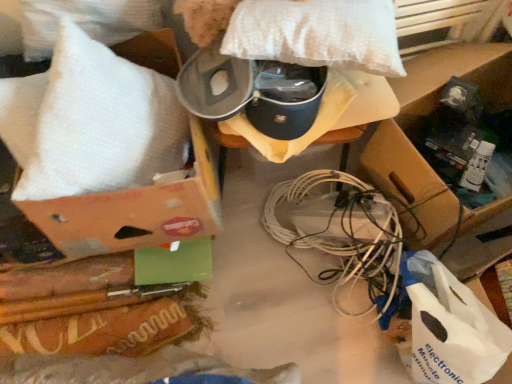
Describe the element at coordinates (90, 122) in the screenshot. I see `white bubble wrap at upper left, the 2th pillow when ordered from right to left` at that location.

At what (x,y) coordinates should I click in order to perform the action: click on white dotted pillow at upper center, which is the 2th pillow in left-to-right order. Please return your answer as a coordinate pair (x, y). This screenshot has height=384, width=512. Looking at the image, I should click on (317, 34).

What do you see at coordinates (450, 326) in the screenshot? I see `white plastic bag at lower right` at bounding box center [450, 326].

At what (x,y) coordinates should I click in order to perform the action: click on white plastic bag at lower right. Please return your answer as a coordinate pair (x, y). Image resolution: width=512 pixels, height=384 pixels. Looking at the image, I should click on (450, 326).

The height and width of the screenshot is (384, 512). Describe the element at coordinates (345, 234) in the screenshot. I see `white plastic wire at center` at that location.

Identify the location of brown cardboard box at lower right. (430, 165).

I want to click on white bubble wrap at upper left, marked as the first pillow in a left-to-right arrangement, so click(90, 122).

Which object is thinner, brown cardboard box at lower right or white dotted pillow at upper center, the first pillow in the right-to-left sequence?

With smaller width is white dotted pillow at upper center, the first pillow in the right-to-left sequence.

Is brown cardboard box at lower right bigger than white dotted pillow at upper center, which is the 2th pillow in left-to-right order?

Indeed, brown cardboard box at lower right has a larger size compared to white dotted pillow at upper center, which is the 2th pillow in left-to-right order.

How far apart are white plastic bag at lower right and brown cardboard box at lower right?

They are 11.87 inches apart.

You are a GUI agent. You are given a task and a screenshot of the screen. Output one action in this format:
    pyautogui.click(x=<x>, y=<y>)
    Task: Click on the cardboard box that is behind the white plastic bag at lower right
    This screenshot has width=512, height=384.
    Given the screenshot: What is the action you would take?
    pyautogui.click(x=430, y=165)

From the image's perspective, is white plastic bag at lower right positioned above or below brown cardboard box at lower right?

Based on their image positions, white plastic bag at lower right is located beneath brown cardboard box at lower right.

From a real-world perspective, who is located lower, white plastic bag at lower right or brown cardboard box at lower right?

white plastic bag at lower right, from a real-world perspective.

From a real-world perspective, is white bubble wrap at upper left, the 2th pillow when ordered from right to left, below white plastic bag at lower right?

No, from a real-world perspective, white bubble wrap at upper left, the 2th pillow when ordered from right to left, is not under white plastic bag at lower right.

Does point (53, 139) lie in front of point (461, 371)?

That is True.

The height and width of the screenshot is (384, 512). I want to click on pillow that is the 2nd object to the left of the white plastic bag at lower right, starting at the anchor, so click(x=90, y=122).

Is point (281, 200) behind point (332, 33)?

Yes.

Who is smaller, white plastic wire at center or white dotted pillow at upper center, which is the 2th pillow in left-to-right order?

white dotted pillow at upper center, which is the 2th pillow in left-to-right order.

Is white plastic wire at center completely or partially outside of white dotted pillow at upper center, the first pillow in the right-to-left sequence?

white plastic wire at center is positioned outside white dotted pillow at upper center, the first pillow in the right-to-left sequence.

Can you confirm if white plastic wire at center is positioned to the right of white dotted pillow at upper center, which is the 2th pillow in left-to-right order?

Yes, white plastic wire at center is to the right of white dotted pillow at upper center, which is the 2th pillow in left-to-right order.

Does white bubble wrap at upper left, marked as the first pillow in a left-to-right arrangement, have a greater height compared to brown cardboard box at lower right?

In fact, white bubble wrap at upper left, marked as the first pillow in a left-to-right arrangement, may be shorter than brown cardboard box at lower right.

Considering the sizes of white bubble wrap at upper left, marked as the first pillow in a left-to-right arrangement, and brown cardboard box at lower right in the image, is white bubble wrap at upper left, marked as the first pillow in a left-to-right arrangement, bigger or smaller than brown cardboard box at lower right?

Clearly, white bubble wrap at upper left, marked as the first pillow in a left-to-right arrangement, is smaller in size than brown cardboard box at lower right.

Between white bubble wrap at upper left, the 2th pillow when ordered from right to left, and brown cardboard box at lower right, which one appears on the left side from the viewer's perspective?

white bubble wrap at upper left, the 2th pillow when ordered from right to left, is more to the left.

Who is more distant, white bubble wrap at upper left, marked as the first pillow in a left-to-right arrangement, or brown cardboard box at lower right?

brown cardboard box at lower right.

Considering the sizes of objects white dotted pillow at upper center, which is the 2th pillow in left-to-right order, and white plastic bag at lower right in the image provided, who is wider, white dotted pillow at upper center, which is the 2th pillow in left-to-right order, or white plastic bag at lower right?

white dotted pillow at upper center, which is the 2th pillow in left-to-right order, is wider.

Considering the positions of objects white dotted pillow at upper center, which is the 2th pillow in left-to-right order, and white plastic bag at lower right in the image provided, who is behind, white dotted pillow at upper center, which is the 2th pillow in left-to-right order, or white plastic bag at lower right?

white plastic bag at lower right is more distant.

How distant is white dotted pillow at upper center, the first pillow in the right-to-left sequence, from white plastic bag at lower right?

23.51 inches.

Between white dotted pillow at upper center, which is the 2th pillow in left-to-right order, and white plastic bag at lower right, which one has less height?

With less height is white dotted pillow at upper center, which is the 2th pillow in left-to-right order.

Which object is closer to the camera, white plastic wire at center or brown cardboard box at lower right?

brown cardboard box at lower right is more forward.

Does white plastic wire at center have a smaller size compared to brown cardboard box at lower right?

Yes.

Which is farther, (376, 219) or (457, 269)?

The point (457, 269) is farther from the camera.

From a real-world perspective, is white plastic wire at center over brown cardboard box at lower right?

No, from a real-world perspective, white plastic wire at center is not on top of brown cardboard box at lower right.

Locate an element on the screen. Image resolution: width=512 pixels, height=384 pixels. cardboard box to the right of white dotted pillow at upper center, which is the 2th pillow in left-to-right order is located at coordinates [x=430, y=165].

At what (x,y) coordinates should I click in order to perform the action: click on cardboard box behind the white plastic bag at lower right. Please return your answer as a coordinate pair (x, y). Image resolution: width=512 pixels, height=384 pixels. Looking at the image, I should click on (430, 165).

Considering their positions, is white plastic wire at center positioned further to brown cardboard box at lower right than white dotted pillow at upper center, the first pillow in the right-to-left sequence?

Among the two, white dotted pillow at upper center, the first pillow in the right-to-left sequence, is located further to brown cardboard box at lower right.

When comparing their distances from white bubble wrap at upper left, marked as the first pillow in a left-to-right arrangement, does white plastic wire at center or white dotted pillow at upper center, which is the 2th pillow in left-to-right order, seem further?

white plastic wire at center is positioned further to the anchor white bubble wrap at upper left, marked as the first pillow in a left-to-right arrangement.

Which object lies nearer to the anchor point white dotted pillow at upper center, the first pillow in the right-to-left sequence, brown cardboard box at lower right or white plastic bag at lower right?

The object closer to white dotted pillow at upper center, the first pillow in the right-to-left sequence, is brown cardboard box at lower right.

Based on the photo, considering their positions, is white dotted pillow at upper center, which is the 2th pillow in left-to-right order, positioned closer to white plastic wire at center than white bubble wrap at upper left, marked as the first pillow in a left-to-right arrangement?

white dotted pillow at upper center, which is the 2th pillow in left-to-right order, is closer to white plastic wire at center.

From the image, which object appears to be farther from white plastic wire at center, white plastic bag at lower right or brown cardboard box at lower right?

brown cardboard box at lower right.

Considering their positions, is white plastic wire at center positioned further to white dotted pillow at upper center, which is the 2th pillow in left-to-right order, than white plastic bag at lower right?

white plastic bag at lower right is positioned further to the anchor white dotted pillow at upper center, which is the 2th pillow in left-to-right order.

When comparing their distances from white plastic wire at center, does white plastic bag at lower right or white dotted pillow at upper center, the first pillow in the right-to-left sequence, seem further?

white dotted pillow at upper center, the first pillow in the right-to-left sequence.

Based on their spatial positions, is white plastic wire at center or white dotted pillow at upper center, which is the 2th pillow in left-to-right order, further from white plastic bag at lower right?

Among the two, white dotted pillow at upper center, which is the 2th pillow in left-to-right order, is located further to white plastic bag at lower right.

Find the location of a particular element. This screenshot has height=384, width=512. pillow located between white bubble wrap at upper left, the 2th pillow when ordered from right to left, and white plastic bag at lower right in the left-right direction is located at coordinates (317, 34).

The width and height of the screenshot is (512, 384). I want to click on wire between white bubble wrap at upper left, marked as the first pillow in a left-to-right arrangement, and white plastic bag at lower right, in the horizontal direction, so click(x=345, y=234).

Where is `wire between brown cardboard box at lower right and white plastic bag at lower right vertically`? This screenshot has width=512, height=384. wire between brown cardboard box at lower right and white plastic bag at lower right vertically is located at coordinates (345, 234).

You are a GUI agent. You are given a task and a screenshot of the screen. Output one action in this format:
    pyautogui.click(x=<x>, y=<y>)
    Task: Click on the wire located between white bubble wrap at upper left, marked as the first pillow in a left-to-right arrangement, and brown cardboard box at lower right in the left-right direction
    The width and height of the screenshot is (512, 384).
    Given the screenshot: What is the action you would take?
    pyautogui.click(x=345, y=234)